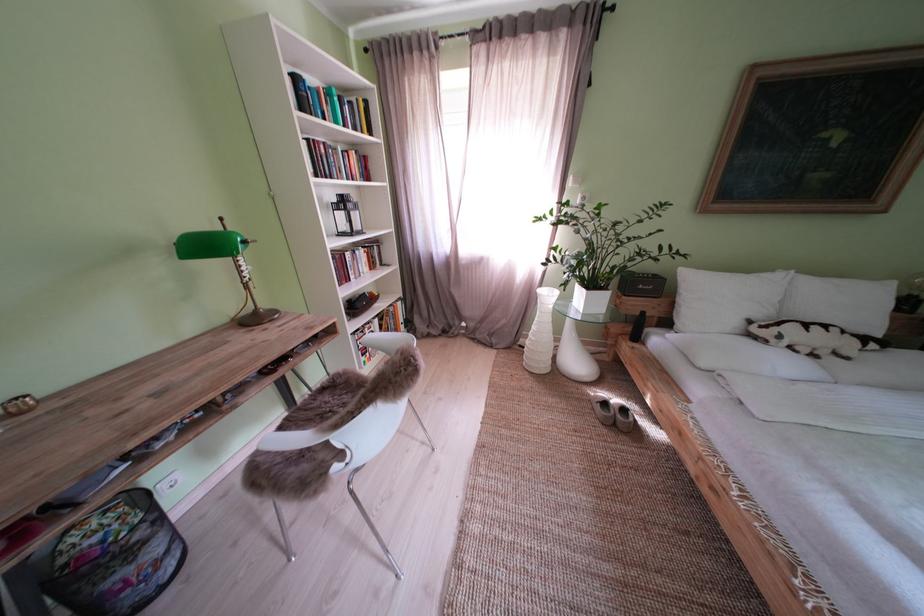
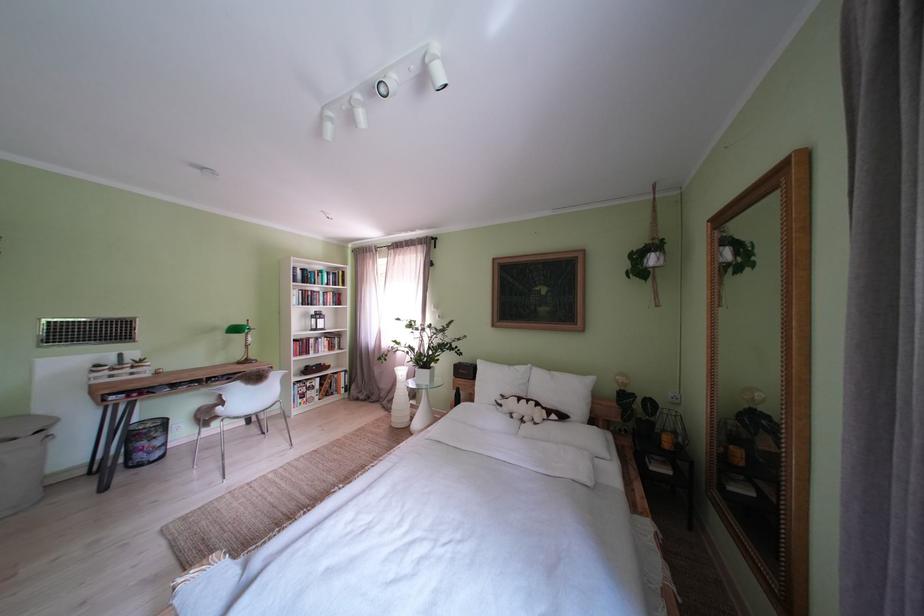
Find the pixel in the second image that matches the point at 505,346 in the first image.

(400, 411)